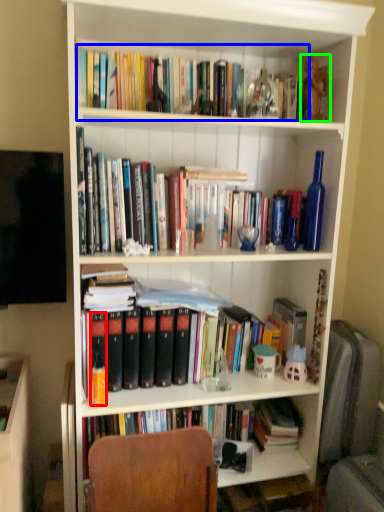
Question: Which is nearer to the paperback book (highlighted by a red box)? book (highlighted by a blue box) or toy (highlighted by a green box).

Choices:
 (A) book
 (B) toy

Answer: (A)